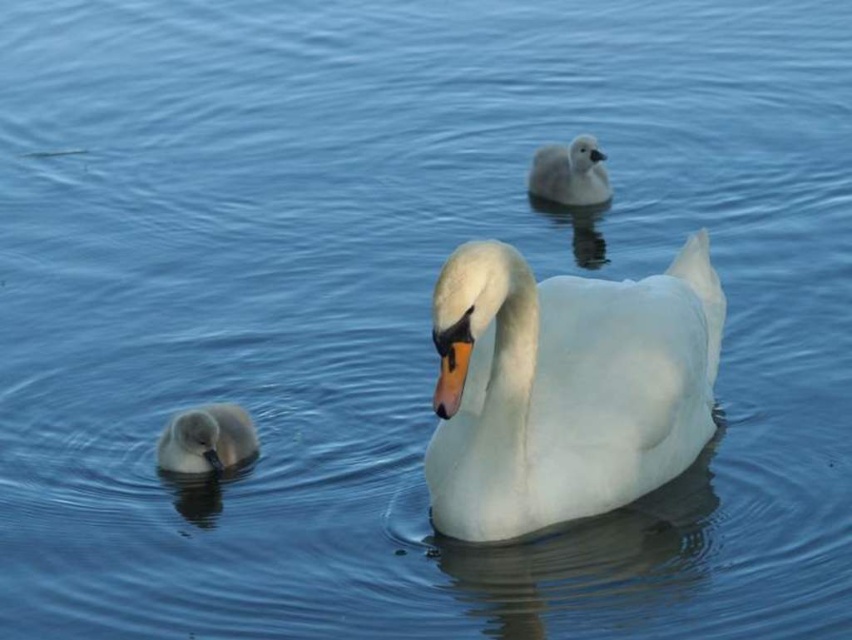
Is white glossy swan at center positioned at the back of soft gray duckling at lower left?

No, white glossy swan at center is in front of soft gray duckling at lower left.

Find the location of a particular element. white glossy swan at center is located at coordinates click(563, 387).

Between point (461, 376) and point (206, 438), which one is positioned behind?

Positioned behind is point (206, 438).

Identify the location of white glossy swan at center. (563, 387).

Is white glossy swan at center smaller than white fluffy duckling at upper center?

Actually, white glossy swan at center might be larger than white fluffy duckling at upper center.

Who is positioned more to the right, white glossy swan at center or white fluffy duckling at upper center?

white fluffy duckling at upper center is more to the right.

In order to click on white glossy swan at center in this screenshot , I will do `click(563, 387)`.

Which is behind, point (197, 468) or point (539, 193)?

Point (539, 193)

Does soft gray duckling at lower left have a greater width compared to white fluffy duckling at upper center?

No, soft gray duckling at lower left is not wider than white fluffy duckling at upper center.

Who is more forward, (197,465) or (594,193)?

Point (197,465) is in front.

Where is `soft gray duckling at lower left`? Image resolution: width=852 pixels, height=640 pixels. soft gray duckling at lower left is located at coordinates tap(206, 440).